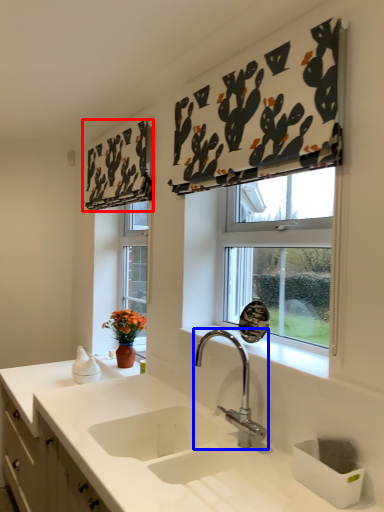
Question: Which object is further to the camera taking this photo, curtain (highlighted by a red box) or tap (highlighted by a blue box)?

Choices:
 (A) curtain
 (B) tap

Answer: (A)